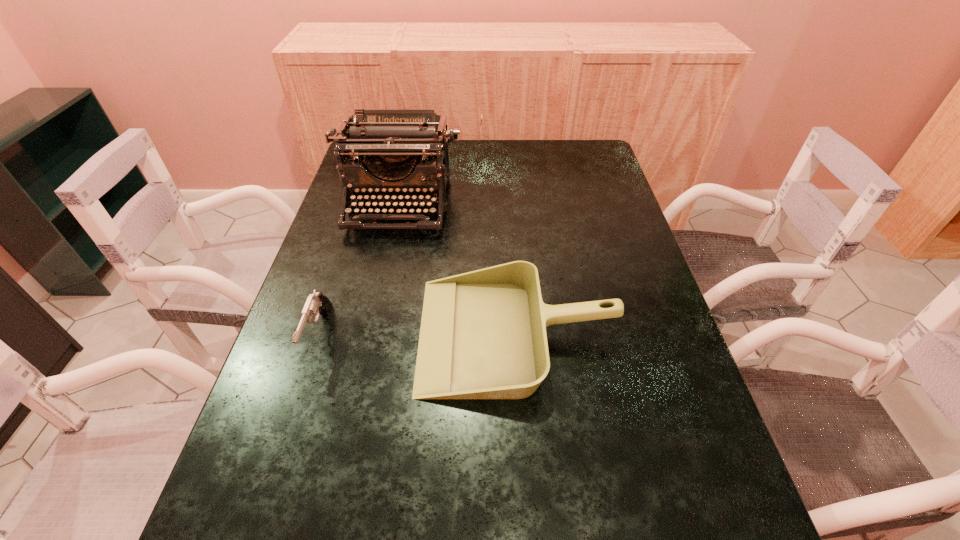
You are a GUI agent. You are given a task and a screenshot of the screen. Output one action in this format:
    pyautogui.click(x=<x>, y=<y>)
    Task: Click on the vacant area that lies between the gun and the farthest object
    
    Given the screenshot: What is the action you would take?
    pyautogui.click(x=358, y=269)

Identify which object is the second nearest to the gun. Please provide its 2D coordinates. Your answer should be formatted as a tuple, i.e. [(x, y)], where the tuple contains the x and y coordinates of a point satisfying the conditions above.

[(401, 137)]

The height and width of the screenshot is (540, 960). What are the coordinates of `object that stands as the closest to the tallest object` in the screenshot? It's located at 483,335.

This screenshot has height=540, width=960. I want to click on free space in the image that satisfies the following two spatial constraints: 1. on the scoop of the dustpan; 2. at the muzzle of the gun, so click(517, 335).